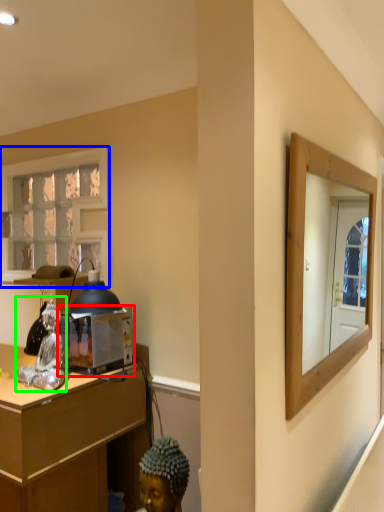
Question: Which is nearer to the appliance (highlighted by a red box)? window (highlighted by a blue box) or figurine (highlighted by a green box).

Choices:
 (A) window
 (B) figurine

Answer: (B)